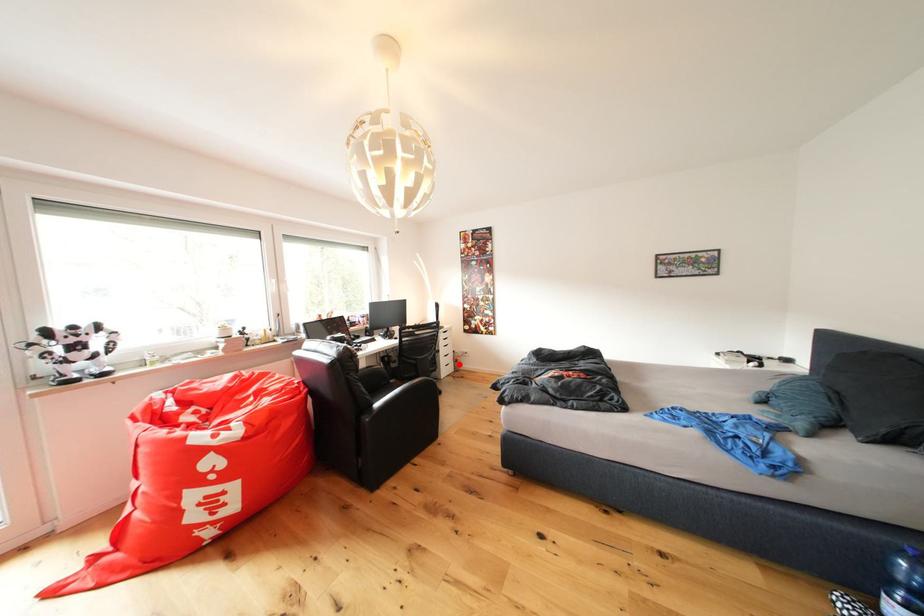
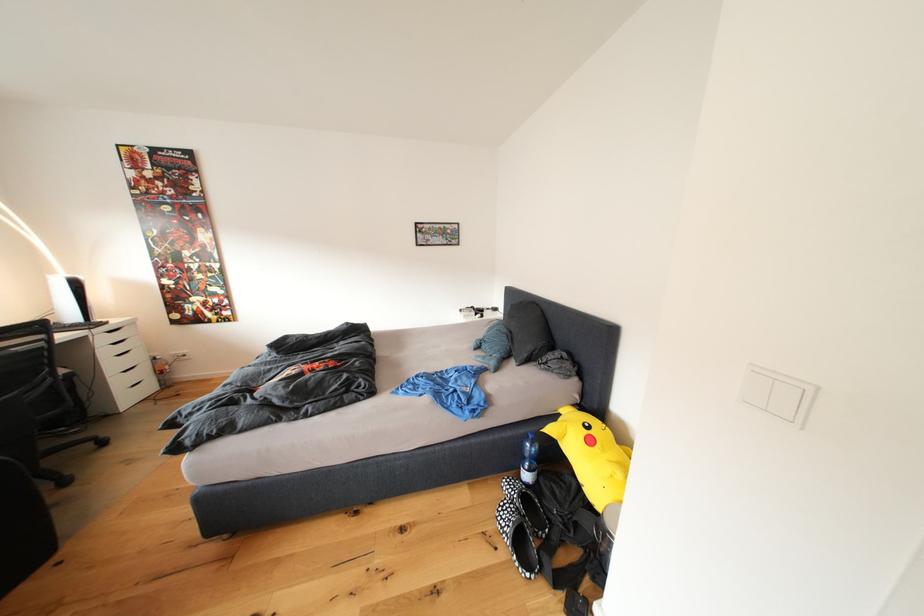
The point at the highlighted location is marked in the first image. Where is the corresponding point in the second image?

(152, 379)